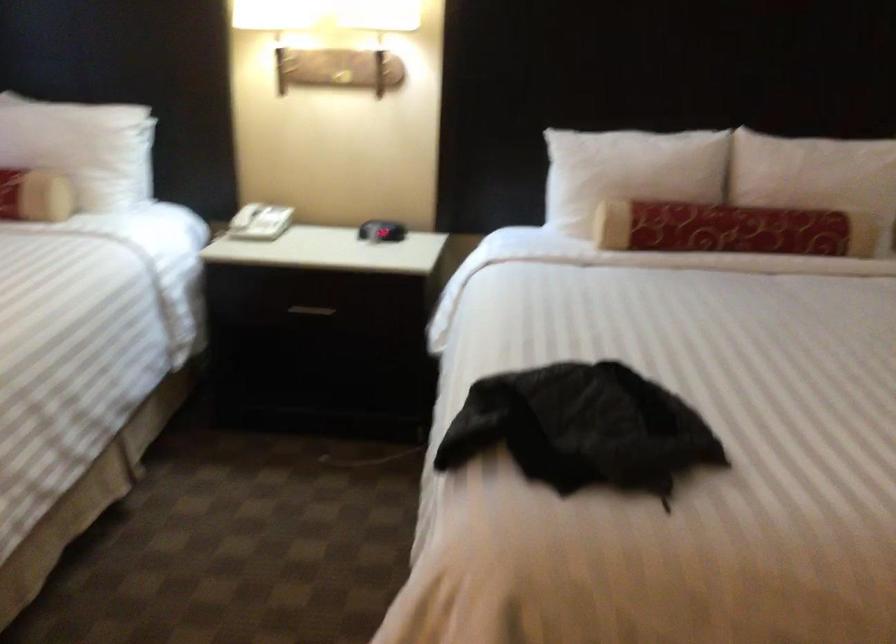
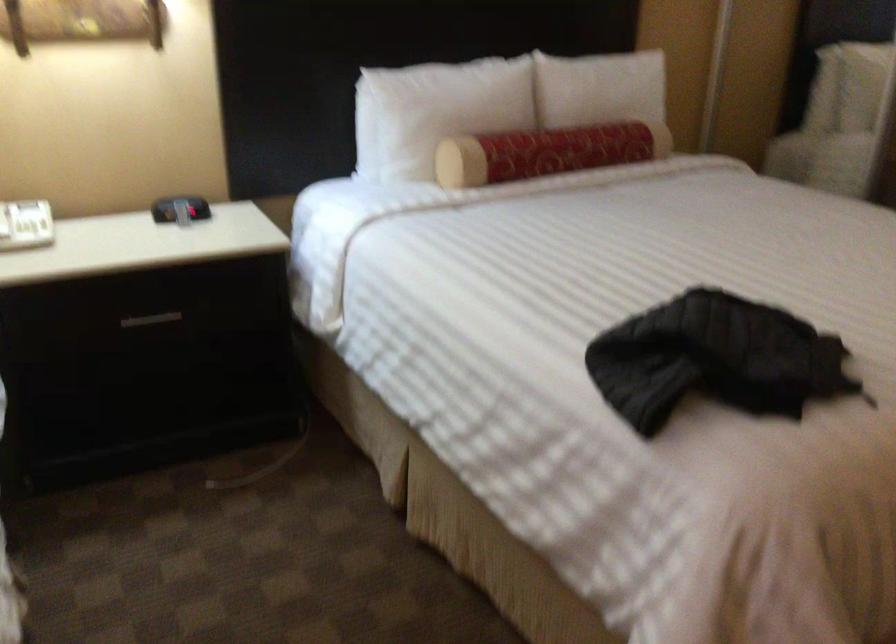
Find the pixel in the second image that matches point (312, 307) in the first image.

(151, 319)